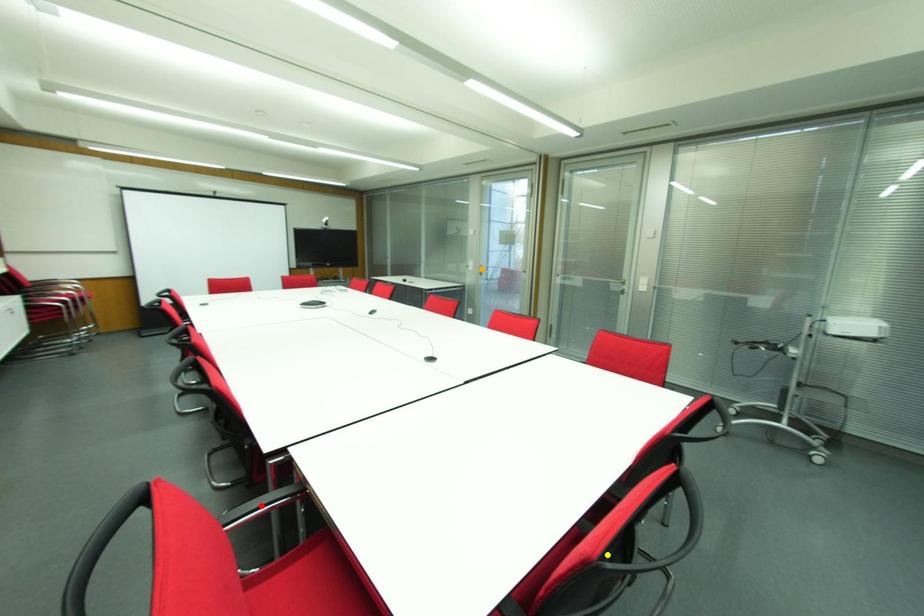
Consider the image. Order these from nearest to farthest:
- yellow point
- orange point
- red point

yellow point → red point → orange point